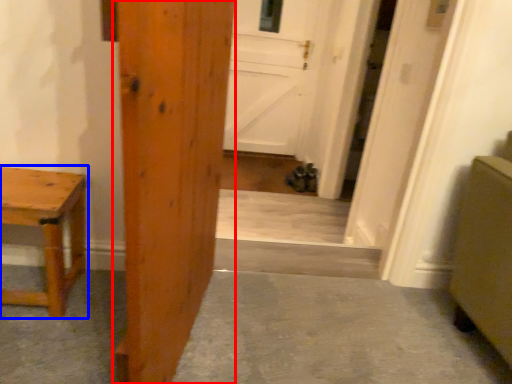
Question: Which object is further to the camera taking this photo, door (highlighted by a red box) or table (highlighted by a blue box)?

Choices:
 (A) door
 (B) table

Answer: (B)